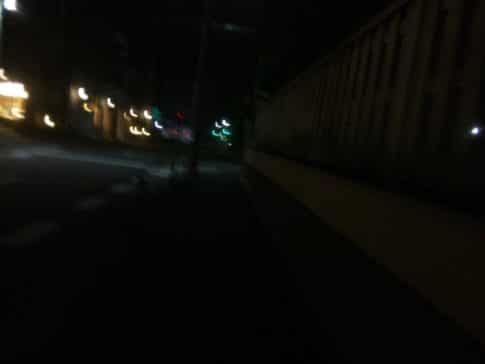
Where is `green lights`? green lights is located at coordinates point(225,132), point(155,110).